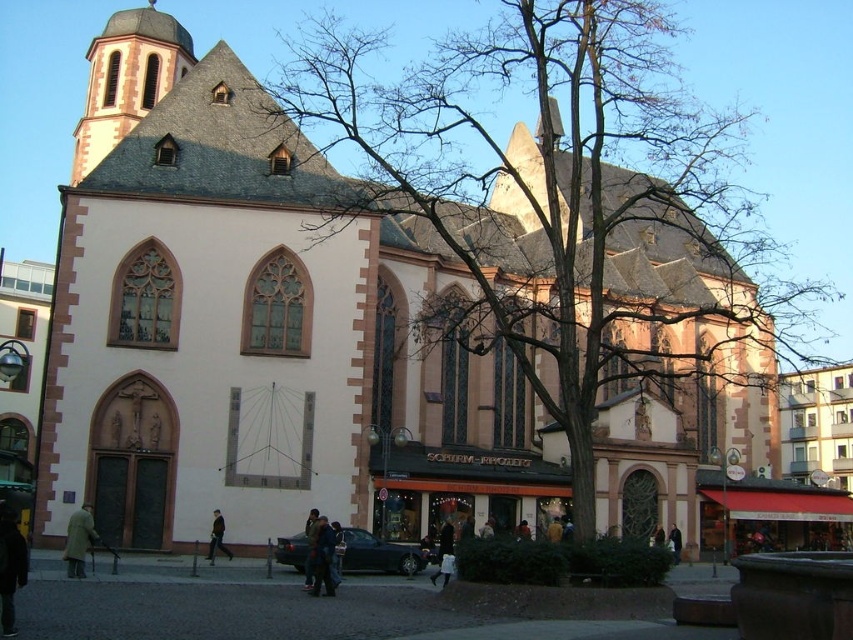
Question: Can you confirm if smooth stone tower at upper left is positioned below dark brown leather jacket at lower left?

Choices:
 (A) yes
 (B) no

Answer: (B)

Question: Among these points, which one is farthest from the camera?

Choices:
 (A) (219, 540)
 (B) (442, 204)
 (C) (67, 566)
 (D) (679, 560)

Answer: (B)

Question: Is bare branches at center thinner than black leather jacket at center?

Choices:
 (A) yes
 (B) no

Answer: (B)

Question: Which of the following is the farthest from the observer?

Choices:
 (A) smooth stone tower at upper left
 (B) black leather jacket at lower center
 (C) dark brown leather jacket at lower left
 (D) black leather jacket at center

Answer: (A)

Question: Which point appears farthest from the camera in this image?

Choices:
 (A) (654, 538)
 (B) (88, 531)
 (C) (668, 547)

Answer: (A)

Question: Is brown leather coat at lower left wider than black leather jacket at center?

Choices:
 (A) no
 (B) yes

Answer: (B)